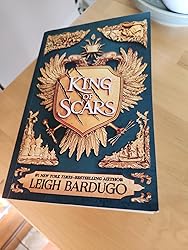
Find the location of `book`. book is located at coordinates (129, 156).